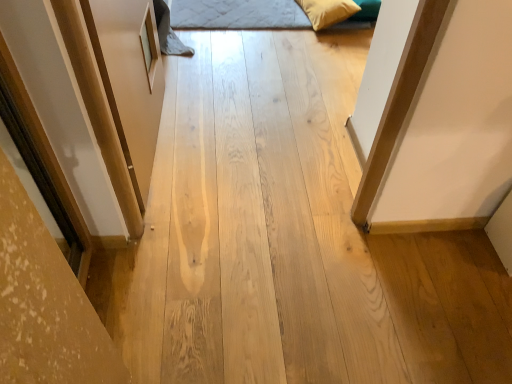
Question: Considering the positions of quilted fabric bed at upper center and velvet yellow pillow at upper right in the image, is quilted fabric bed at upper center taller or shorter than velvet yellow pillow at upper right?

Choices:
 (A) short
 (B) tall

Answer: (A)

Question: Considering the relative positions of quilted fabric bed at upper center and velvet yellow pillow at upper right in the image provided, is quilted fabric bed at upper center to the left or to the right of velvet yellow pillow at upper right?

Choices:
 (A) left
 (B) right

Answer: (A)

Question: In terms of size, does quilted fabric bed at upper center appear bigger or smaller than velvet yellow pillow at upper right?

Choices:
 (A) small
 (B) big

Answer: (B)

Question: Is velvet yellow pillow at upper right spatially inside quilted fabric bed at upper center, or outside of it?

Choices:
 (A) outside
 (B) inside

Answer: (A)

Question: Considering the relative positions of velvet yellow pillow at upper right and quilted fabric bed at upper center in the image provided, is velvet yellow pillow at upper right to the left or to the right of quilted fabric bed at upper center?

Choices:
 (A) right
 (B) left

Answer: (A)

Question: Relative to quilted fabric bed at upper center, is velvet yellow pillow at upper right in front or behind?

Choices:
 (A) front
 (B) behind

Answer: (A)

Question: Does point (354, 8) appear closer or farther from the camera than point (246, 26)?

Choices:
 (A) closer
 (B) farther

Answer: (A)